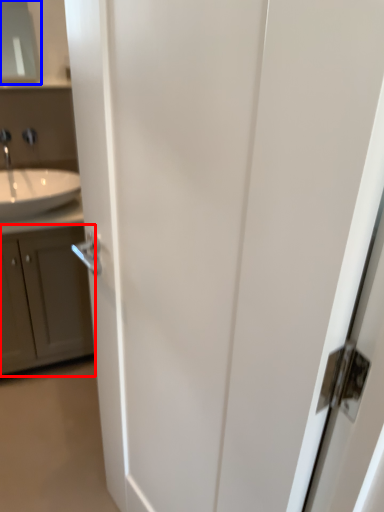
Question: Which of the following is the closest to the observer, cabinetry (highlighted by a red box) or medicine cabinet (highlighted by a blue box)?

Choices:
 (A) cabinetry
 (B) medicine cabinet

Answer: (A)